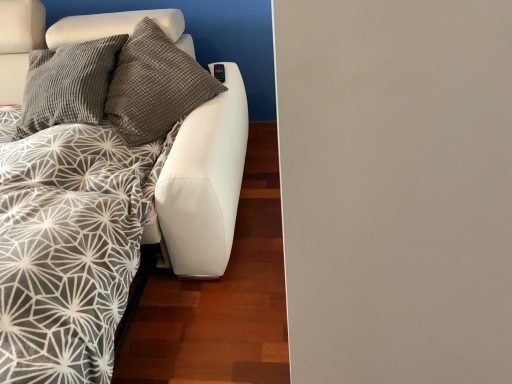
Question: Is white leather couch at left taller or shorter than textured gray pillows at upper left?

Choices:
 (A) tall
 (B) short

Answer: (A)

Question: In the image, is white leather couch at left on the left side or the right side of textured gray pillows at upper left?

Choices:
 (A) right
 (B) left

Answer: (B)

Question: Looking at their shapes, would you say white leather couch at left is wider or thinner than textured gray pillows at upper left?

Choices:
 (A) thin
 (B) wide

Answer: (B)

Question: From the image's perspective, is textured gray pillows at upper left located above or below white leather couch at left?

Choices:
 (A) above
 (B) below

Answer: (A)

Question: Does point (225, 14) appear closer or farther from the camera than point (53, 367)?

Choices:
 (A) farther
 (B) closer

Answer: (A)

Question: Looking at the image, does textured gray pillows at upper left seem bigger or smaller compared to white leather couch at left?

Choices:
 (A) big
 (B) small

Answer: (B)

Question: In terms of width, does textured gray pillows at upper left look wider or thinner when compared to white leather couch at left?

Choices:
 (A) thin
 (B) wide

Answer: (A)